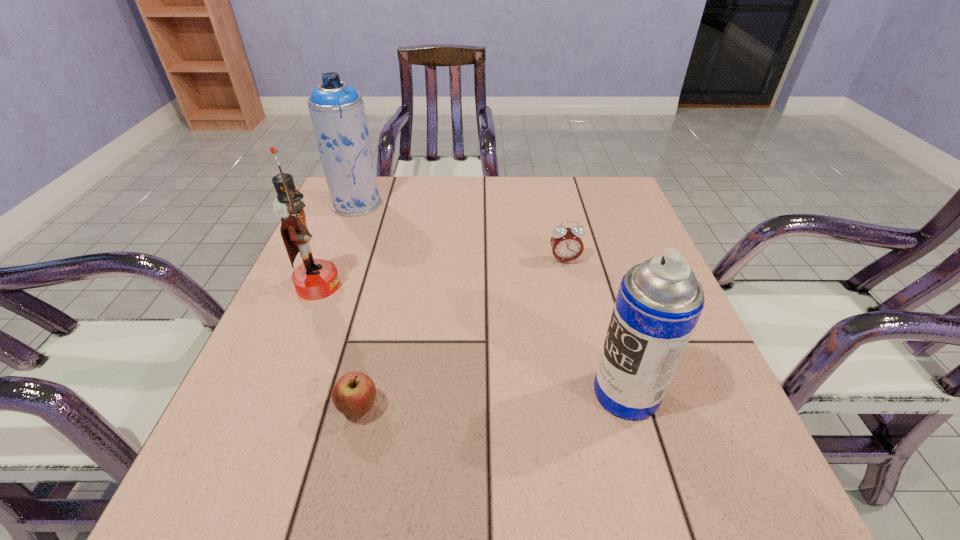
I want to click on vacant space at the far edge of the desktop, so click(458, 212).

At what (x,y) coordinates should I click in order to perform the action: click on vacant region at the near edge of the desktop. Please return your answer as a coordinate pair (x, y). The image size is (960, 540). Looking at the image, I should click on 377,523.

I want to click on vacant area at the left edge of the desktop, so click(x=217, y=455).

At what (x,y) coordinates should I click in order to perform the action: click on vacant space at the right edge. Please return your answer as a coordinate pair (x, y). This screenshot has width=960, height=540. Looking at the image, I should click on (611, 226).

The width and height of the screenshot is (960, 540). What are the coordinates of `vacant space at the near left corner of the desktop` in the screenshot? It's located at (271, 525).

At what (x,y) coordinates should I click in order to perform the action: click on free point at the far right corner. Please return your answer as a coordinate pair (x, y). The width and height of the screenshot is (960, 540). Looking at the image, I should click on (569, 191).

The width and height of the screenshot is (960, 540). In order to click on free point between the third nearest object and the nearer aerosol can in this screenshot , I will do `click(472, 339)`.

Locate an element on the screen. The width and height of the screenshot is (960, 540). free space between the right aerosol can and the farther aerosol can is located at coordinates (492, 298).

Image resolution: width=960 pixels, height=540 pixels. I want to click on vacant space in between the second shortest object and the farther aerosol can, so click(461, 232).

You are a GUI agent. You are given a task and a screenshot of the screen. Output one action in this format:
    pyautogui.click(x=<x>, y=<y>)
    Task: Click on the vacant space that's between the right aerosol can and the left aerosol can
    
    Given the screenshot: What is the action you would take?
    (492, 298)